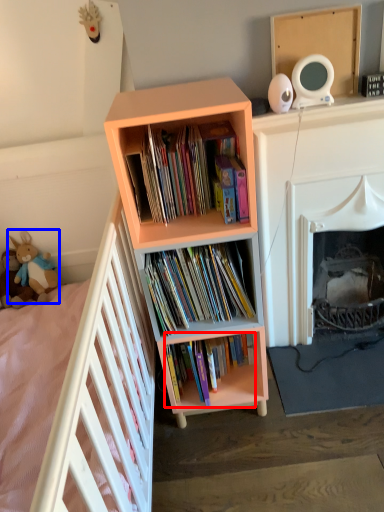
Question: Which point is further to the camera, book (highlighted by a red box) or toy (highlighted by a blue box)?

Choices:
 (A) book
 (B) toy

Answer: (B)